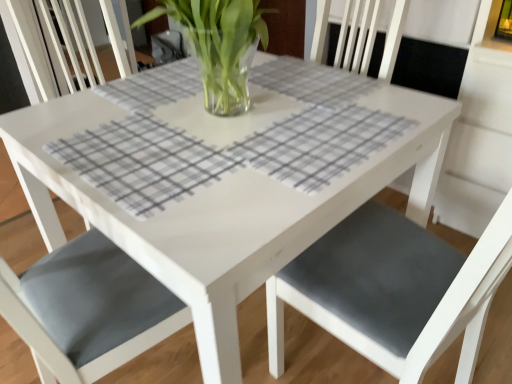
Describe the element at coordinates (219, 45) in the screenshot. I see `clear glass vase at center` at that location.

This screenshot has width=512, height=384. Find the location of `clear glass vase at center`. clear glass vase at center is located at coordinates (219, 45).

The width and height of the screenshot is (512, 384). Identify the location of clear glass vase at center. (219, 45).